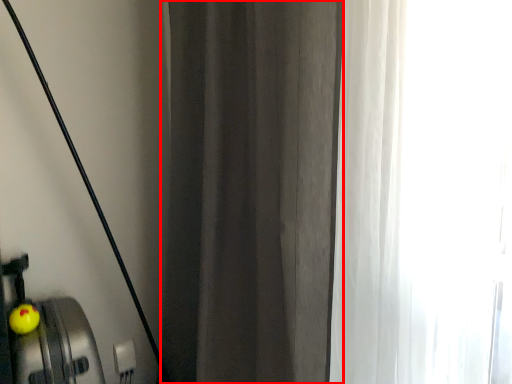
Question: From the image's perspective, what is the correct spatial relationship of curtain (annotated by the red box) in relation to apple?

Choices:
 (A) above
 (B) below

Answer: (A)